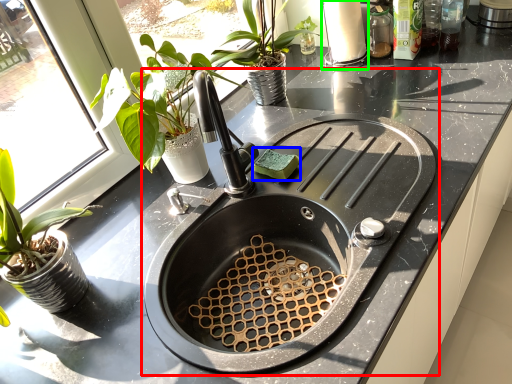
Question: Which object is the farthest from sink (highlighted by a red box)? Choose among these: food (highlighted by a blue box) or appliance (highlighted by a green box).

Choices:
 (A) food
 (B) appliance

Answer: (B)